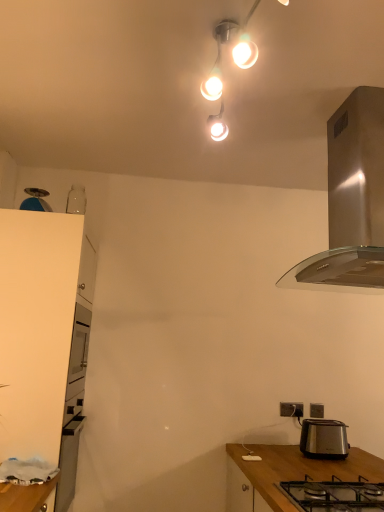
Question: Is matte black power outlet at lower right, which is the 1th power outlet from right to left, a part of matte white light fixture at upper center?

Choices:
 (A) no
 (B) yes

Answer: (A)

Question: Considering the relative sizes of matte white light fixture at upper center and matte black power outlet at lower right, which is the 1th power outlet from right to left, in the image provided, is matte white light fixture at upper center thinner than matte black power outlet at lower right, which is the 1th power outlet from right to left,?

Choices:
 (A) yes
 (B) no

Answer: (B)

Question: Are matte white light fixture at upper center and matte black power outlet at lower right, acting as the 2th power outlet starting from the left, far apart?

Choices:
 (A) no
 (B) yes

Answer: (B)

Question: Can you confirm if matte white light fixture at upper center is bigger than matte black power outlet at lower right, which is the 1th power outlet from right to left?

Choices:
 (A) no
 (B) yes

Answer: (B)

Question: Could you tell me if matte white light fixture at upper center is facing matte black power outlet at lower right, acting as the 2th power outlet starting from the left?

Choices:
 (A) no
 (B) yes

Answer: (A)

Question: Considering the positions of black metal/glass gas stove at lower center and satin silver toaster at lower right in the image, is black metal/glass gas stove at lower center bigger or smaller than satin silver toaster at lower right?

Choices:
 (A) big
 (B) small

Answer: (A)

Question: In terms of height, does black metal/glass gas stove at lower center look taller or shorter compared to satin silver toaster at lower right?

Choices:
 (A) tall
 (B) short

Answer: (B)

Question: Visually, is black metal/glass gas stove at lower center positioned to the left or to the right of satin silver toaster at lower right?

Choices:
 (A) right
 (B) left

Answer: (B)

Question: In the image, is black metal/glass gas stove at lower center positioned in front of or behind satin silver toaster at lower right?

Choices:
 (A) front
 (B) behind

Answer: (A)

Question: From the image's perspective, is satin silver toaster at lower right above or below black metal/glass gas stove at lower center?

Choices:
 (A) below
 (B) above

Answer: (A)

Question: Considering the positions of point (337, 452) and point (380, 504), is point (337, 452) closer or farther from the camera than point (380, 504)?

Choices:
 (A) closer
 (B) farther

Answer: (B)

Question: Relative to black metal/glass gas stove at lower center, is satin silver toaster at lower right in front or behind?

Choices:
 (A) front
 (B) behind

Answer: (B)

Question: Based on their sizes in the image, would you say satin silver toaster at lower right is bigger or smaller than black metal/glass gas stove at lower center?

Choices:
 (A) small
 (B) big

Answer: (A)

Question: Choose the correct answer: Is black metal/glass gas stove at lower center inside satin silver range hood at upper right or outside it?

Choices:
 (A) inside
 (B) outside

Answer: (B)

Question: Is point (306, 481) closer or farther from the camera than point (352, 222)?

Choices:
 (A) closer
 (B) farther

Answer: (B)